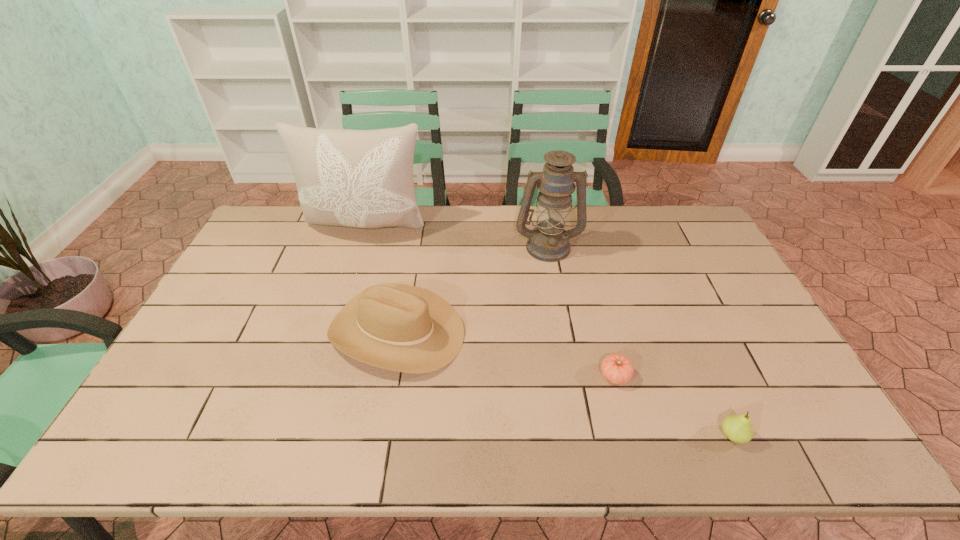
The height and width of the screenshot is (540, 960). Identify the location of the third closest object to the cushion. coord(616,368).

Find the location of `vacant area that satisfies the following two spatial constraints: 1. on the back side of the oil lamp; 2. on the right side of the cowboy hat`. vacant area that satisfies the following two spatial constraints: 1. on the back side of the oil lamp; 2. on the right side of the cowboy hat is located at coordinates (412, 246).

The width and height of the screenshot is (960, 540). In order to click on free space that satisfies the following two spatial constraints: 1. on the front side of the cushion; 2. on the right side of the oil lamp in this screenshot , I will do `click(361, 246)`.